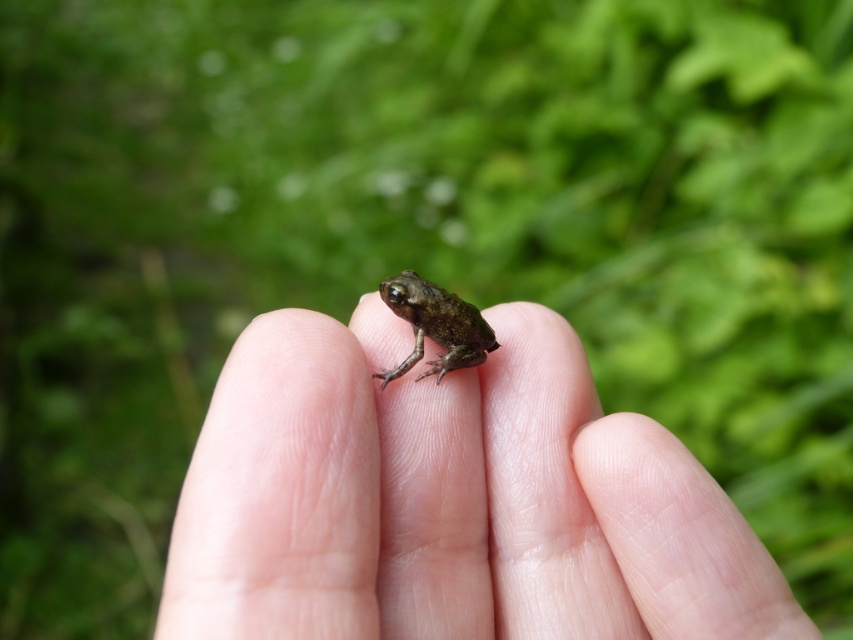
You are a biologist observing a frog in a forest. You notice a green matte frog at center resting on a smooth skin palm at center. Which object is larger in size?

The smooth skin palm at center is bigger than the green matte frog at center.